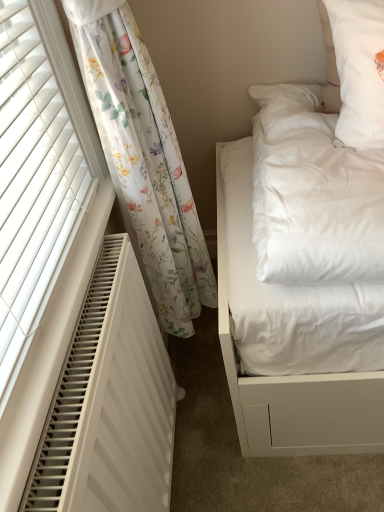
Question: Is floral sheer curtain at left located outside white textured radiator at left?

Choices:
 (A) no
 (B) yes

Answer: (B)

Question: Does floral sheer curtain at left have a greater height compared to white textured radiator at left?

Choices:
 (A) yes
 (B) no

Answer: (A)

Question: Considering the relative sizes of floral sheer curtain at left and white textured radiator at left in the image provided, is floral sheer curtain at left bigger than white textured radiator at left?

Choices:
 (A) no
 (B) yes

Answer: (B)

Question: Does floral sheer curtain at left appear on the left side of white textured radiator at left?

Choices:
 (A) yes
 (B) no

Answer: (B)

Question: From a real-world perspective, is floral sheer curtain at left on white textured radiator at left?

Choices:
 (A) no
 (B) yes

Answer: (B)

Question: Can you confirm if floral sheer curtain at left is positioned to the right of white textured radiator at left?

Choices:
 (A) no
 (B) yes

Answer: (B)

Question: Is white textured radiator at left oriented away from floral sheer curtain at left?

Choices:
 (A) yes
 (B) no

Answer: (B)

Question: Could floral sheer curtain at left be considered to be inside white textured radiator at left?

Choices:
 (A) no
 (B) yes

Answer: (A)

Question: Considering the relative sizes of white textured radiator at left and floral sheer curtain at left in the image provided, is white textured radiator at left wider than floral sheer curtain at left?

Choices:
 (A) yes
 (B) no

Answer: (B)

Question: Can you confirm if white textured radiator at left is thinner than floral sheer curtain at left?

Choices:
 (A) yes
 (B) no

Answer: (A)

Question: From the image's perspective, is white textured radiator at left under floral sheer curtain at left?

Choices:
 (A) no
 (B) yes

Answer: (B)

Question: Does white textured radiator at left come behind floral sheer curtain at left?

Choices:
 (A) no
 (B) yes

Answer: (A)

Question: From the image's perspective, is floral sheer curtain at left above or below white textured radiator at left?

Choices:
 (A) above
 (B) below

Answer: (A)